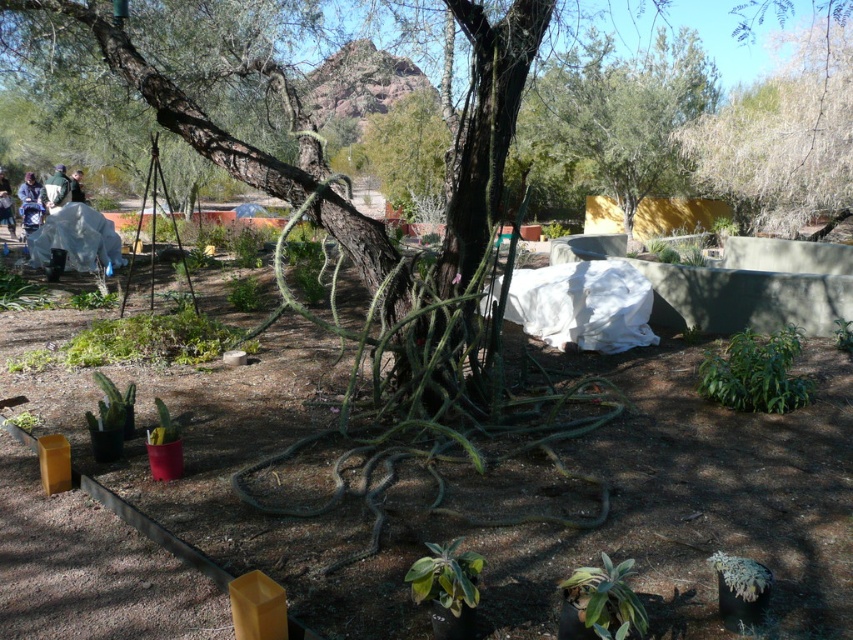
Find the location of a particular element. The image size is (853, 640). light blue denim jacket at upper left is located at coordinates (6, 204).

Which is in front, point (820, 132) or point (73, 182)?

Positioned in front is point (73, 182).

How distant is white textured tree at upper right from dark blue shirt at upper left?

The distance of white textured tree at upper right from dark blue shirt at upper left is 19.33 meters.

Who is more forward, (793, 147) or (71, 173)?

Point (793, 147) is more forward.

Locate an element on the screen. This screenshot has height=640, width=853. white textured tree at upper right is located at coordinates (784, 136).

Which is more to the right, white textured tree at upper right or white matte suit at left?

white textured tree at upper right is more to the right.

How far apart are white textured tree at upper right and white matte suit at left?

A distance of 19.58 meters exists between white textured tree at upper right and white matte suit at left.

Is point (834, 205) positioned in front of point (57, 252)?

No, (834, 205) is behind (57, 252).

Where is `white textured tree at upper right`? The height and width of the screenshot is (640, 853). white textured tree at upper right is located at coordinates (784, 136).